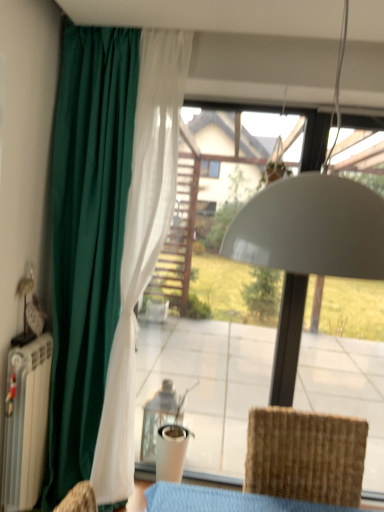
Describe the element at coordinates (100, 252) in the screenshot. I see `green fabric curtain at left` at that location.

Locate an element on the screen. green fabric curtain at left is located at coordinates 100,252.

What do you see at coordinates (305, 456) in the screenshot? The width and height of the screenshot is (384, 512). I see `woven brown chair at lower right` at bounding box center [305, 456].

Where is `woven brown chair at lower right`? The width and height of the screenshot is (384, 512). woven brown chair at lower right is located at coordinates [x=305, y=456].

Find the location of a particular element. green fabric curtain at left is located at coordinates [100, 252].

Is woven brown chair at lower right at the right side of green fabric curtain at left?

Yes, woven brown chair at lower right is to the right of green fabric curtain at left.

Considering the relative positions of woven brown chair at lower right and green fabric curtain at left in the image provided, is woven brown chair at lower right in front of green fabric curtain at left?

Yes.

Does point (330, 452) come in front of point (143, 254)?

Yes, it is.

From the image's perspective, who appears lower, woven brown chair at lower right or green fabric curtain at left?

woven brown chair at lower right.

In the scene shown: From a real-world perspective, which object stands above the other?

In real-world perspective, green fabric curtain at left is above.

Considering the sizes of objects woven brown chair at lower right and green fabric curtain at left in the image provided, who is wider, woven brown chair at lower right or green fabric curtain at left?

woven brown chair at lower right is wider.

Can you confirm if woven brown chair at lower right is shorter than green fabric curtain at left?

Indeed, woven brown chair at lower right has a lesser height compared to green fabric curtain at left.

In the scene shown: Does woven brown chair at lower right have a larger size compared to green fabric curtain at left?

No.

Is woven brown chair at lower right outside of green fabric curtain at left?

Yes.

Is woven brown chair at lower right far away from green fabric curtain at left?

Absolutely, woven brown chair at lower right is distant from green fabric curtain at left.

Is green fabric curtain at left at the back of woven brown chair at lower right?

woven brown chair at lower right does not have its back to green fabric curtain at left.

How much distance is there between woven brown chair at lower right and green fabric curtain at left?

They are 3.73 feet apart.

At what (x,y) coordinates should I click in order to perform the action: click on curtain that is on the left side of woven brown chair at lower right. Please return your answer as a coordinate pair (x, y). Image resolution: width=384 pixels, height=512 pixels. Looking at the image, I should click on (100, 252).

Which is more to the right, green fabric curtain at left or woven brown chair at lower right?

woven brown chair at lower right.

Looking at this image, is green fabric curtain at left behind woven brown chair at lower right?

Yes, the depth of green fabric curtain at left is greater than that of woven brown chair at lower right.

Is point (74, 167) closer to camera compared to point (293, 453)?

No, (74, 167) is further to viewer.

From the image's perspective, is green fabric curtain at left over woven brown chair at lower right?

Indeed, from the image's perspective, green fabric curtain at left is shown above woven brown chair at lower right.

From a real-world perspective, does green fabric curtain at left stand above woven brown chair at lower right?

Yes, from a real-world perspective, green fabric curtain at left is on top of woven brown chair at lower right.

Based on the photo, is green fabric curtain at left wider than woven brown chair at lower right?

No, green fabric curtain at left is not wider than woven brown chair at lower right.

Between green fabric curtain at left and woven brown chair at lower right, which one has less height?

With less height is woven brown chair at lower right.

Can you confirm if green fabric curtain at left is bigger than woven brown chair at lower right?

Yes, green fabric curtain at left is bigger than woven brown chair at lower right.

Would you say green fabric curtain at left is outside woven brown chair at lower right?

Absolutely, green fabric curtain at left is external to woven brown chair at lower right.

Can you see green fabric curtain at left touching woven brown chair at lower right?

No, green fabric curtain at left is not beside woven brown chair at lower right.

Is green fabric curtain at left oriented towards woven brown chair at lower right?

No, green fabric curtain at left is not turned towards woven brown chair at lower right.

Can you tell me how much green fabric curtain at left and woven brown chair at lower right differ in facing direction?

The angle between the facing direction of green fabric curtain at left and the facing direction of woven brown chair at lower right is 4.92 degrees.

How distant is green fabric curtain at left from woven brown chair at lower right?

A distance of 1.14 meters exists between green fabric curtain at left and woven brown chair at lower right.

Where is `chair below the green fabric curtain at left (from a real-world perspective)`? Image resolution: width=384 pixels, height=512 pixels. chair below the green fabric curtain at left (from a real-world perspective) is located at coordinates (305, 456).

Identify the location of curtain on the left of the woven brown chair at lower right. The height and width of the screenshot is (512, 384). (100, 252).

Identify the location of chair in front of the green fabric curtain at left. Image resolution: width=384 pixels, height=512 pixels. (305, 456).